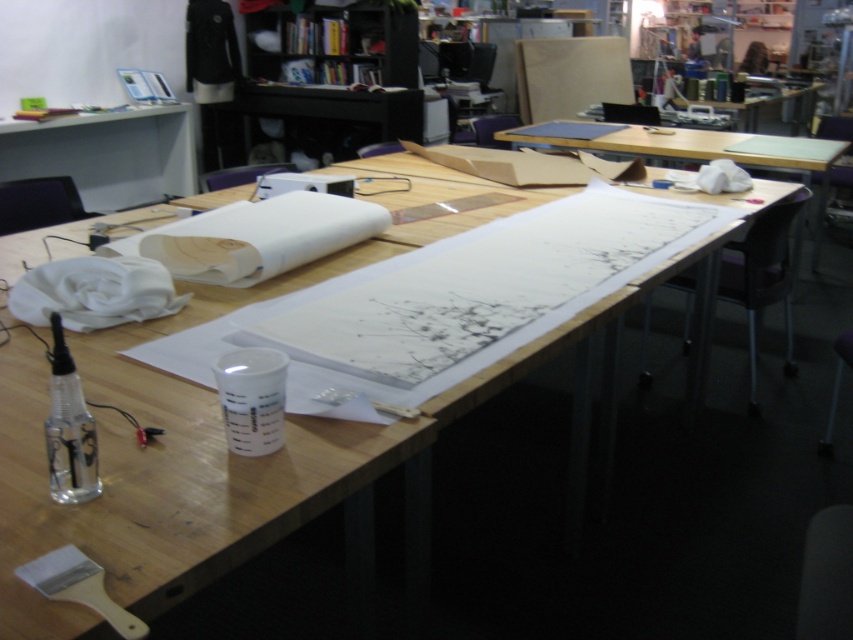
Does wooden table at center have a larger size compared to matte white desk at upper left?

Yes, wooden table at center is bigger than matte white desk at upper left.

Does wooden table at center have a smaller size compared to matte white desk at upper left?

Incorrect, wooden table at center is not smaller in size than matte white desk at upper left.

Locate an element on the screen. The width and height of the screenshot is (853, 640). wooden table at center is located at coordinates (222, 433).

Locate an element on the screen. This screenshot has height=640, width=853. wooden table at center is located at coordinates (222, 433).

Can you confirm if matte white desk at upper left is positioned to the left of white paper at center?

Yes, matte white desk at upper left is to the left of white paper at center.

Is matte white desk at upper left smaller than white paper at center?

Correct, matte white desk at upper left occupies less space than white paper at center.

Is point (18, 145) positioned behind point (627, 141)?

Yes, point (18, 145) is farther from viewer.

In order to click on matte white desk at upper left in this screenshot , I will do `click(106, 154)`.

Where is `wooden table at center`? The height and width of the screenshot is (640, 853). wooden table at center is located at coordinates (222, 433).

Is wooden table at center below white paper at center?

Indeed, wooden table at center is positioned under white paper at center.

Who is more forward, (323, 269) or (819, 240)?

Point (323, 269)

Image resolution: width=853 pixels, height=640 pixels. What are the coordinates of `wooden table at center` in the screenshot? It's located at (222, 433).